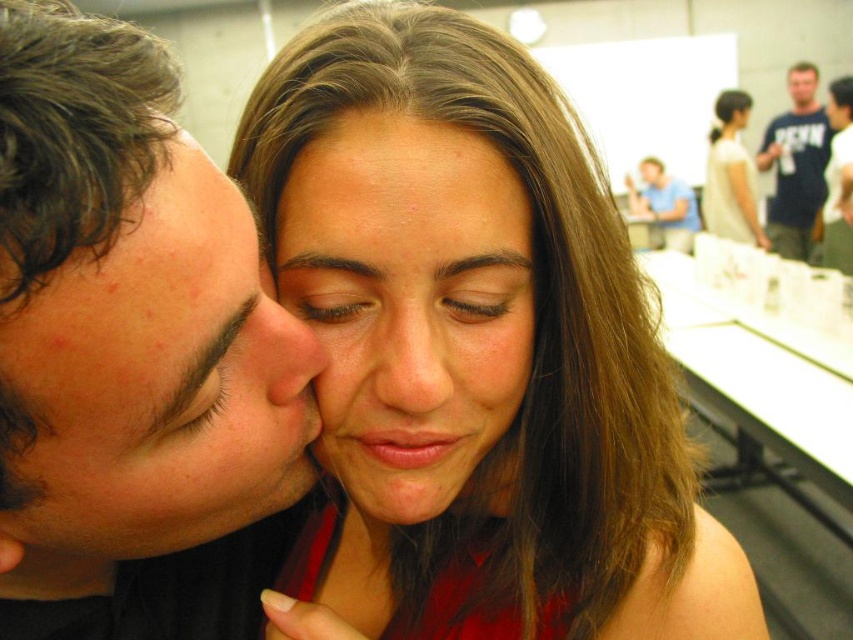
Question: Which point is farther from the camera taking this photo?

Choices:
 (A) (525, 212)
 (B) (811, 86)

Answer: (B)

Question: Does smooth skin at center appear on the left side of smooth skin nose at center?

Choices:
 (A) yes
 (B) no

Answer: (A)

Question: Which of these objects is positioned closest to the smooth skin face at upper right?

Choices:
 (A) smooth skin face at center
 (B) smooth skin at center
 (C) blue shirt at upper center
 (D) blue t-shirt at upper right

Answer: (D)

Question: Is oily skin face at left positioned at the back of smooth skin at center?

Choices:
 (A) yes
 (B) no

Answer: (B)

Question: Is blue cotton shirt at upper right above matte skin nose at center?

Choices:
 (A) no
 (B) yes

Answer: (B)

Question: Which of the following is the farthest from the observer?

Choices:
 (A) (463, 148)
 (B) (260, 298)
 (C) (180, 170)
 (D) (651, 202)

Answer: (D)